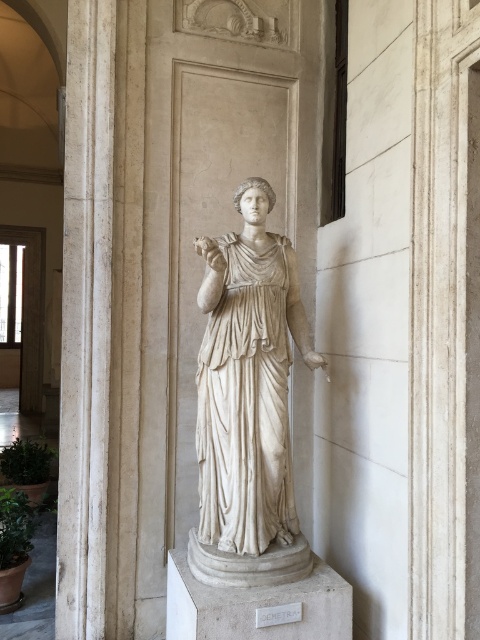
Question: Does white marble statue at center have a lesser width compared to white marble pillar at center?

Choices:
 (A) yes
 (B) no

Answer: (B)

Question: Which point is closer to the camera?

Choices:
 (A) white marble pillar at center
 (B) white marble statue at center

Answer: (B)

Question: Can you confirm if white marble statue at center is positioned below white marble pillar at center?

Choices:
 (A) no
 (B) yes

Answer: (B)

Question: Is white marble statue at center further to the viewer compared to white marble pillar at center?

Choices:
 (A) no
 (B) yes

Answer: (A)

Question: Which of the following is the closest to the observer?

Choices:
 (A) (219, 308)
 (B) (84, 480)

Answer: (A)